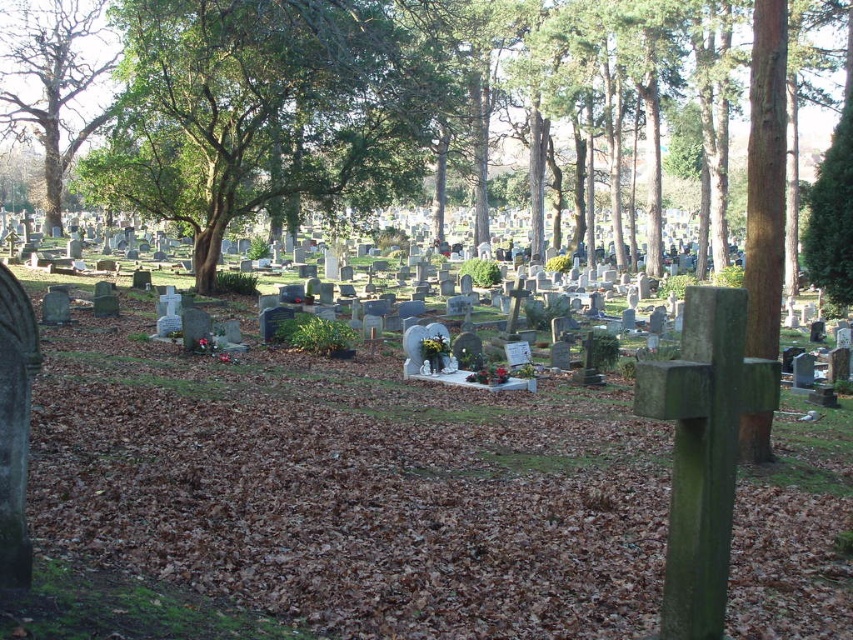
Between point (248, 525) and point (167, 72), which one is positioned in front?

Point (248, 525) is more forward.

Between smooth stone cross at center and green leafy tree at center, which one has less height?

Standing shorter between the two is smooth stone cross at center.

At what (x,y) coordinates should I click in order to perform the action: click on smooth stone cross at center. Please return your answer as a coordinate pair (x, y). The width and height of the screenshot is (853, 640). Looking at the image, I should click on (351, 486).

Image resolution: width=853 pixels, height=640 pixels. What are the coordinates of `smooth stone cross at center` in the screenshot? It's located at (351, 486).

Between green leafy tree at center and green leafy tree at upper left, which one is positioned higher?

green leafy tree at upper left

Can you confirm if green leafy tree at center is positioned to the left of green leafy tree at upper left?

In fact, green leafy tree at center is to the right of green leafy tree at upper left.

Is point (199, 280) positioned before point (49, 72)?

Yes.

I want to click on green leafy tree at center, so click(x=267, y=109).

Locate an element on the screen. This screenshot has width=853, height=640. smooth stone cross at center is located at coordinates (351, 486).

Is smooth stone cross at center thinner than green leafy tree at upper left?

Indeed, smooth stone cross at center has a lesser width compared to green leafy tree at upper left.

The width and height of the screenshot is (853, 640). I want to click on smooth stone cross at center, so click(x=351, y=486).